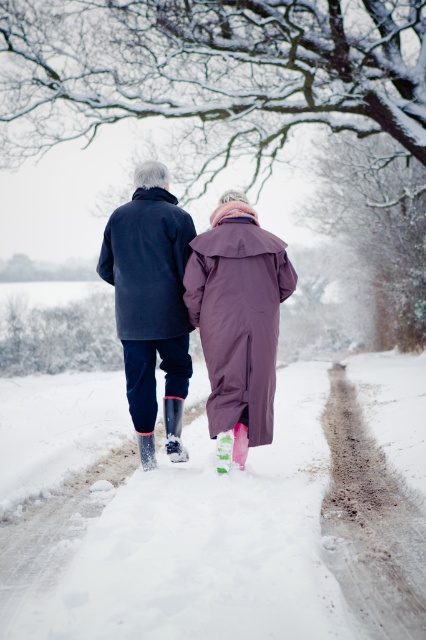
Question: Does matte black coat at center appear over dark blue wool coat at center?

Choices:
 (A) yes
 (B) no

Answer: (B)

Question: Which point is closer to the camera?

Choices:
 (A) purple waterproof coat at center
 (B) dark blue wool coat at center

Answer: (A)

Question: From the image, what is the correct spatial relationship of matte black coat at center in relation to purple waterproof coat at center?

Choices:
 (A) right
 (B) left

Answer: (B)

Question: Which of the following is the farthest from the observer?

Choices:
 (A) purple waterproof coat at center
 (B) dark blue wool coat at center
 (C) matte black coat at center

Answer: (B)

Question: Is the position of purple waterproof coat at center more distant than that of dark blue wool coat at center?

Choices:
 (A) yes
 (B) no

Answer: (B)

Question: Which object is closer to the camera taking this photo?

Choices:
 (A) dark blue wool coat at center
 (B) matte black coat at center
 (C) purple waterproof coat at center

Answer: (C)